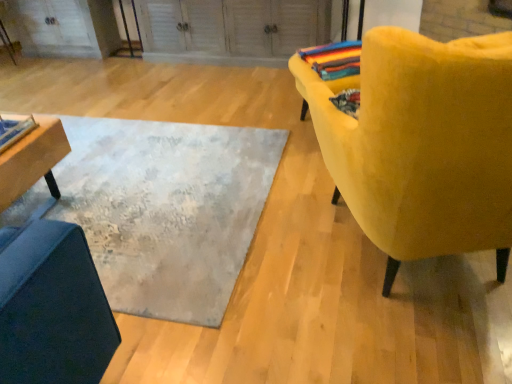
What is the approximate height of textured gray rug at center?

textured gray rug at center is 1.72 inches tall.

The width and height of the screenshot is (512, 384). I want to click on wooden table at left, so click(32, 160).

Identify the location of chair above the textured gray rug at center (from the image's perspective). (422, 144).

Would you say textured gray rug at center contains velvet yellow chair at right?

No, velvet yellow chair at right is not surrounded by textured gray rug at center.

In the image, is textured gray rug at center positioned in front of or behind velvet yellow chair at right?

In the image, textured gray rug at center appears behind velvet yellow chair at right.

Is textured gray rug at center aimed at velvet yellow chair at right?

No, textured gray rug at center is not oriented towards velvet yellow chair at right.

Is textured gray rug at center inside the boundaries of multicolored woven blanket at upper right, or outside?

textured gray rug at center is located beyond the bounds of multicolored woven blanket at upper right.

From the image's perspective, which one is positioned higher, textured gray rug at center or multicolored woven blanket at upper right?

multicolored woven blanket at upper right, from the image's perspective.

Which is farther, (444, 172) or (118, 204)?

The point (118, 204) is behind.

Between velvet yellow chair at right and textured gray rug at center, which one appears on the right side from the viewer's perspective?

velvet yellow chair at right.

Considering their positions, is velvet yellow chair at right located in front of or behind textured gray rug at center?

velvet yellow chair at right is positioned closer to the viewer than textured gray rug at center.

Between velvet yellow chair at right and textured gray rug at center, which one has smaller width?

With smaller width is velvet yellow chair at right.

From the image's perspective, which is above, textured gray rug at center or wooden table at left?

From the image's view, textured gray rug at center is above.

Would you say textured gray rug at center contains wooden table at left?

No, wooden table at left is not a part of textured gray rug at center.

Find the location of a particular element. mat that appears below the wooden table at left (from a real-world perspective) is located at coordinates tap(166, 209).

Which is further, (201,247) or (15,187)?

The point (201,247) is farther from the camera.

In the scene shown: Is wooden table at left further to camera compared to velvet yellow chair at right?

Yes, wooden table at left is further from the camera.

What are the coordinates of `table behind the velvet yellow chair at right` in the screenshot? It's located at (32, 160).

From a real-world perspective, which is physically above, wooden table at left or velvet yellow chair at right?

velvet yellow chair at right.

What's the angular difference between wooden table at left and velvet yellow chair at right's facing directions?

wooden table at left and velvet yellow chair at right are facing 22.1 degrees away from each other.

Can you confirm if wooden table at left is taller than multicolored woven blanket at upper right?

Indeed, wooden table at left has a greater height compared to multicolored woven blanket at upper right.

This screenshot has width=512, height=384. I want to click on table that appears on the left of multicolored woven blanket at upper right, so click(x=32, y=160).

In terms of size, does wooden table at left appear bigger or smaller than multicolored woven blanket at upper right?

Clearly, wooden table at left is larger in size than multicolored woven blanket at upper right.

From the image's perspective, between wooden table at left and multicolored woven blanket at upper right, which one is located above?

From the image's view, multicolored woven blanket at upper right is above.

From a real-world perspective, is multicolored woven blanket at upper right physically below textured gray rug at center?

No, from a real-world perspective, multicolored woven blanket at upper right is not beneath textured gray rug at center.

Between multicolored woven blanket at upper right and textured gray rug at center, which one has larger width?

textured gray rug at center is wider.

Does multicolored woven blanket at upper right have a lesser height compared to textured gray rug at center?

No, multicolored woven blanket at upper right is not shorter than textured gray rug at center.

Locate an element on the screen. This screenshot has height=384, width=512. mat in front of the multicolored woven blanket at upper right is located at coordinates (166, 209).

The height and width of the screenshot is (384, 512). What are the coordinates of `mat that appears below the velvet yellow chair at right (from the image's perspective)` in the screenshot? It's located at (166, 209).

Locate an element on the screen. blanket behind the textured gray rug at center is located at coordinates (334, 59).

Based on their spatial positions, is wooden table at left or velvet yellow chair at right closer to multicolored woven blanket at upper right?

velvet yellow chair at right.

Based on their spatial positions, is wooden table at left or multicolored woven blanket at upper right closer to velvet yellow chair at right?

multicolored woven blanket at upper right lies closer to velvet yellow chair at right than the other object.

Based on the photo, from the image, which object appears to be farther from velvet yellow chair at right, textured gray rug at center or wooden table at left?

Among the two, wooden table at left is located further to velvet yellow chair at right.

Which object lies nearer to the anchor point multicolored woven blanket at upper right, textured gray rug at center or wooden table at left?

Based on the image, textured gray rug at center appears to be nearer to multicolored woven blanket at upper right.

Looking at the image, which one is located closer to textured gray rug at center, multicolored woven blanket at upper right or velvet yellow chair at right?

velvet yellow chair at right is closer to textured gray rug at center.

Estimate the real-world distances between objects in this image. Which object is closer to wooden table at left, multicolored woven blanket at upper right or textured gray rug at center?

textured gray rug at center is closer to wooden table at left.

Looking at the image, which one is located further to textured gray rug at center, multicolored woven blanket at upper right or wooden table at left?

Among the two, multicolored woven blanket at upper right is located further to textured gray rug at center.

Based on their spatial positions, is velvet yellow chair at right or textured gray rug at center further from wooden table at left?

velvet yellow chair at right lies further to wooden table at left than the other object.

Identify the location of blanket between textured gray rug at center and velvet yellow chair at right. The width and height of the screenshot is (512, 384). (334, 59).

The height and width of the screenshot is (384, 512). What are the coordinates of `mat between wooden table at left and multicolored woven blanket at upper right from left to right` in the screenshot? It's located at (166, 209).

You are a GUI agent. You are given a task and a screenshot of the screen. Output one action in this format:
    pyautogui.click(x=<x>, y=<y>)
    Task: Click on the mat situated between wooden table at left and velvet yellow chair at right from left to right
    Image resolution: width=512 pixels, height=384 pixels.
    Given the screenshot: What is the action you would take?
    (166, 209)

Find the location of `blanket between wooden table at left and velvet yellow chair at right`. blanket between wooden table at left and velvet yellow chair at right is located at coordinates (334, 59).